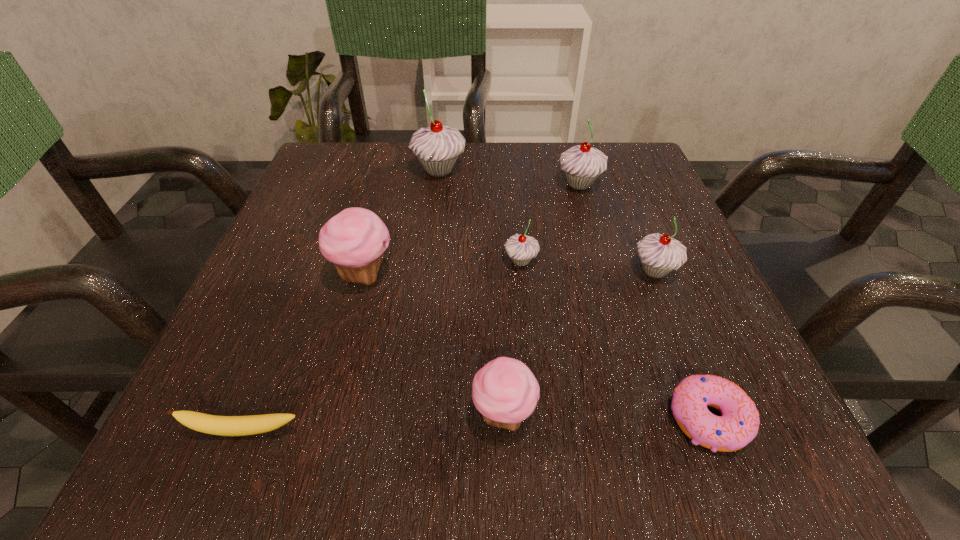
Locate an element on the screen. Image resolution: width=960 pixels, height=540 pixels. vacant space that satisfies the following two spatial constraints: 1. on the front side of the second tallest object; 2. on the left side of the rightmost cupcake is located at coordinates (604, 271).

This screenshot has height=540, width=960. What are the coordinates of `vacant space that satisfies the following two spatial constraints: 1. on the front side of the smallest gray cupcake; 2. on the right side of the second smallest gray cupcake` in the screenshot? It's located at (521, 271).